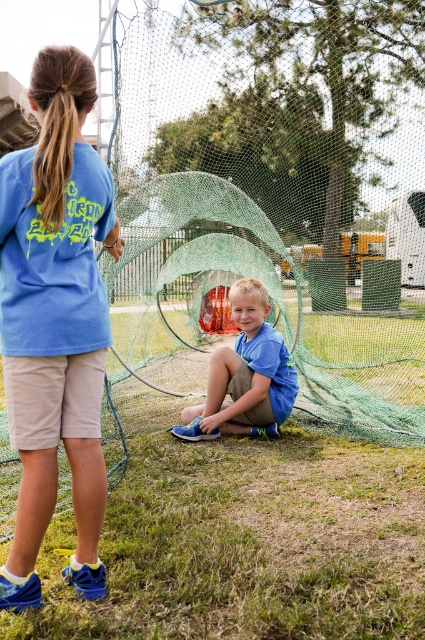
You are a photographer trying to capture a clear photo of the red object inside the net structure. You notice two children wearing blue cotton shirts in the frame. Which child, the blue cotton shirt at upper left or the blue cotton shirt at center, is blocking your view of the red object?

The blue cotton shirt at upper left is positioned over the blue cotton shirt at center, so the blue cotton shirt at upper left is blocking the view of the red object.

You are a photographer standing at a safe distance. You want to take a photo of the green mesh fishing net at center without getting too close. What is the minimum distance you should maintain to ensure safety?

The minimum distance you should maintain is 14.54 feet to ensure safety while taking the photo of the green mesh fishing net at center.